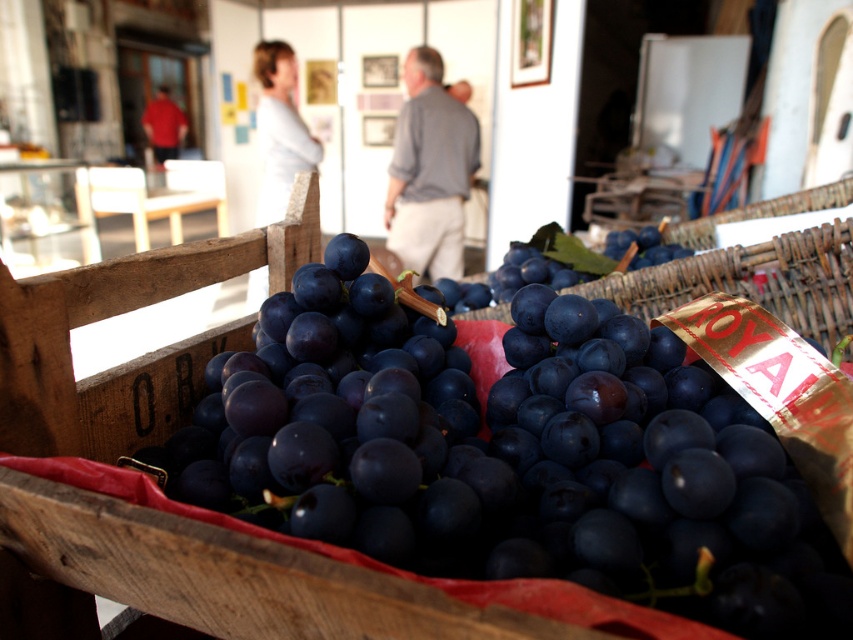
Question: Which point is closer to the camera?

Choices:
 (A) dark purple grapes at center
 (B) shiny dark purple grapes at center

Answer: (B)

Question: Does shiny dark purple grapes at center lie in front of dark purple grapes at center?

Choices:
 (A) no
 (B) yes

Answer: (B)

Question: Can you confirm if shiny dark purple grapes at center is positioned to the left of dark purple grapes at center?

Choices:
 (A) no
 (B) yes

Answer: (B)

Question: Is shiny dark purple grapes at center to the right of dark purple grapes at center from the viewer's perspective?

Choices:
 (A) no
 (B) yes

Answer: (A)

Question: Which point is closer to the camera?

Choices:
 (A) (747, 586)
 (B) (643, 234)

Answer: (A)